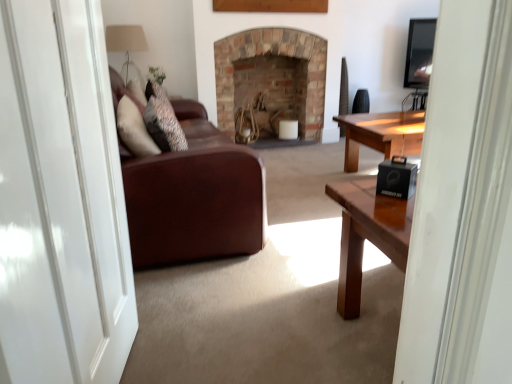
Question: Would you say black matte speaker at lower right is part of leather couch at center's contents?

Choices:
 (A) yes
 (B) no

Answer: (B)

Question: Is leather couch at center to the left of black matte speaker at lower right from the viewer's perspective?

Choices:
 (A) yes
 (B) no

Answer: (A)

Question: Is leather couch at center positioned behind black matte speaker at lower right?

Choices:
 (A) yes
 (B) no

Answer: (A)

Question: Is leather couch at center with black matte speaker at lower right?

Choices:
 (A) no
 (B) yes

Answer: (A)

Question: Does leather couch at center have a smaller size compared to black matte speaker at lower right?

Choices:
 (A) no
 (B) yes

Answer: (A)

Question: Is leather couch at center at the right side of black matte speaker at lower right?

Choices:
 (A) no
 (B) yes

Answer: (A)

Question: Is white glossy door at left at the back of leather couch at center?

Choices:
 (A) yes
 (B) no

Answer: (B)

Question: Are leather couch at center and white glossy door at left beside each other?

Choices:
 (A) no
 (B) yes

Answer: (A)

Question: Is leather couch at center not within white glossy door at left?

Choices:
 (A) no
 (B) yes

Answer: (B)

Question: Is leather couch at center thinner than white glossy door at left?

Choices:
 (A) no
 (B) yes

Answer: (A)

Question: Is leather couch at center surrounding white glossy door at left?

Choices:
 (A) yes
 (B) no

Answer: (B)

Question: Can you confirm if leather couch at center is wider than white glossy door at left?

Choices:
 (A) yes
 (B) no

Answer: (A)

Question: Is leather couch at center at the left side of translucent glass lampshade at upper left?

Choices:
 (A) yes
 (B) no

Answer: (B)